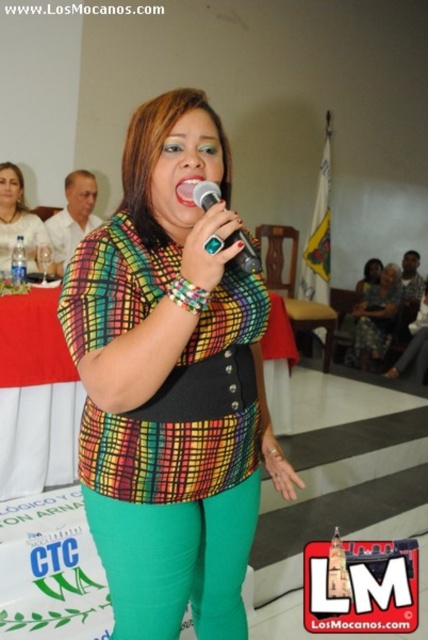
You are a photographer at the event and want to capture a photo that includes both the point at (392, 268) and the point at (187, 184). Based on their positions, which point is located further back in the scene?

Point at (392, 268) is behind point at (187, 184), so the point at (392, 268) is further back.